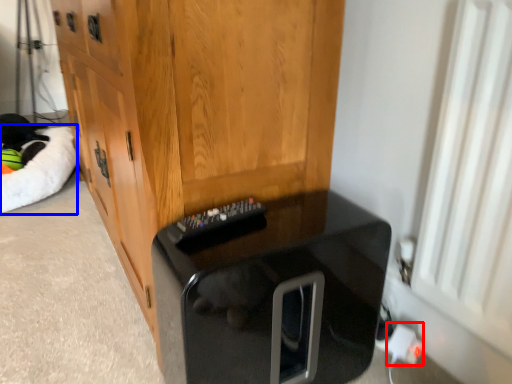
Question: Among these objects, which one is farthest to the camera, electric outlet (highlighted by a red box) or cat bed (highlighted by a blue box)?

Choices:
 (A) electric outlet
 (B) cat bed

Answer: (B)